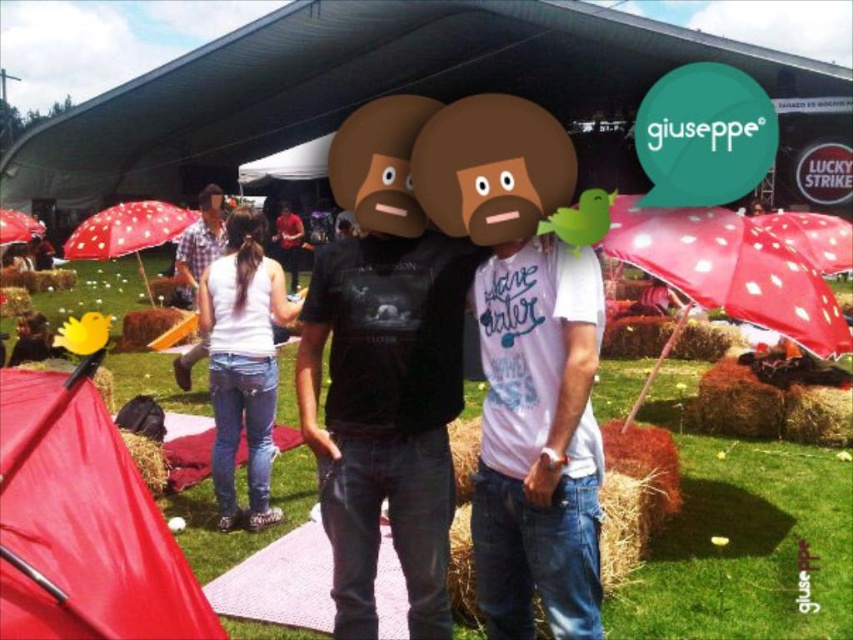
Is red polka dot fabric umbrella at right thinner than white denim jeans at lower left?

Incorrect, red polka dot fabric umbrella at right's width is not less than white denim jeans at lower left's.

Looking at this image, is red polka dot fabric umbrella at right closer to camera compared to white denim jeans at lower left?

Yes, red polka dot fabric umbrella at right is closer to the viewer.

Locate an element on the screen. The width and height of the screenshot is (853, 640). red polka dot fabric umbrella at right is located at coordinates (729, 269).

Based on the photo, can you confirm if red fabric canopy at lower left is smaller than red shirt at center?

Actually, red fabric canopy at lower left might be larger than red shirt at center.

Image resolution: width=853 pixels, height=640 pixels. Describe the element at coordinates (83, 525) in the screenshot. I see `red fabric canopy at lower left` at that location.

Identify the location of red fabric canopy at lower left. This screenshot has height=640, width=853. (83, 525).

Can you confirm if red dotted umbrella at lower left is shorter than red matte umbrella at left?

Incorrect, red dotted umbrella at lower left's height does not fall short of red matte umbrella at left's.

Can you confirm if red dotted umbrella at lower left is smaller than red matte umbrella at left?

Actually, red dotted umbrella at lower left might be larger than red matte umbrella at left.

Between point (88, 225) and point (0, 218), which one is positioned in front?

Point (88, 225) is more forward.

Identify the location of red dotted umbrella at lower left. This screenshot has height=640, width=853. (126, 232).